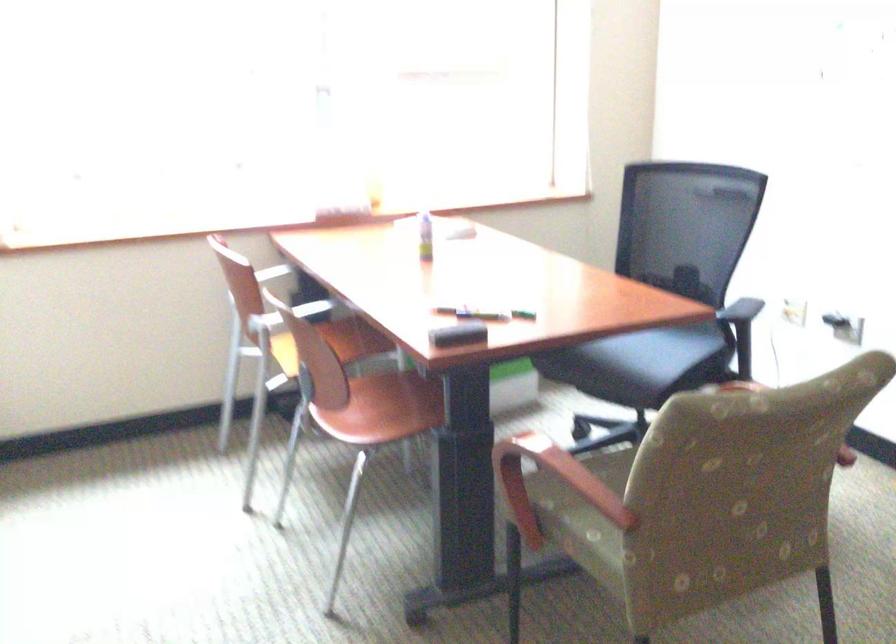
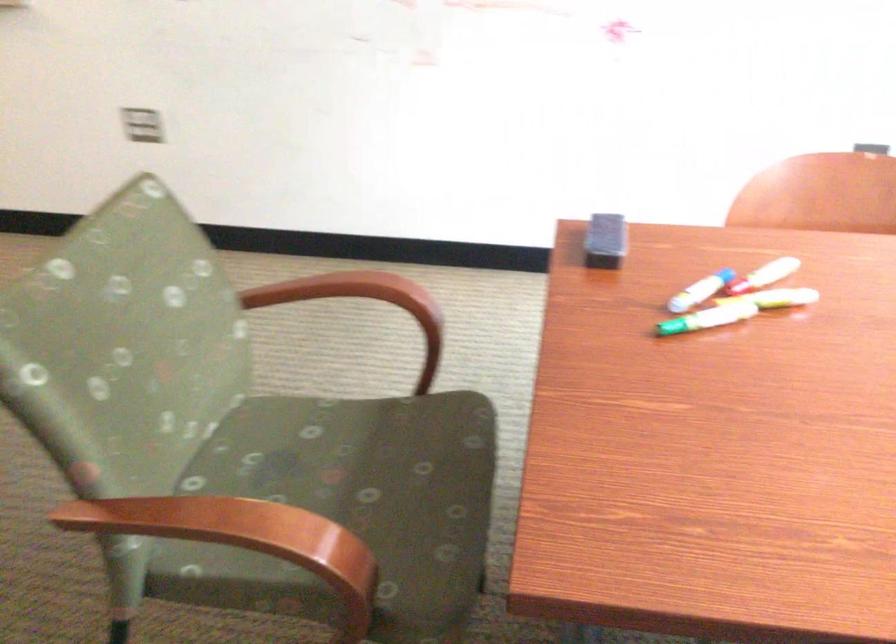
Find the pixel in the second image that matches pixel 527 460 in the first image.

(346, 290)